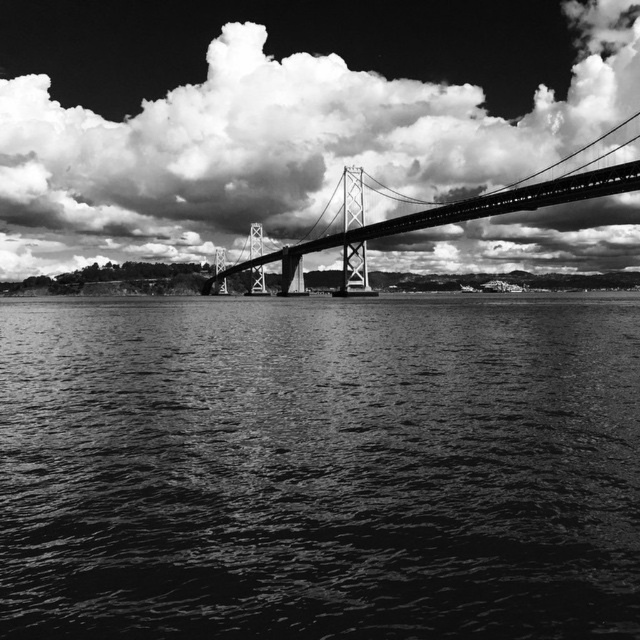
You are standing at the viewpoint where the photo was taken. You see two points on the suspension bridge in the image. The first point is at coordinates point (445, 301) and the second is at point (572, 17). Which point is nearer to you?

Point (445, 301) is closer to the camera than point (572, 17), so the first point is nearer to you.